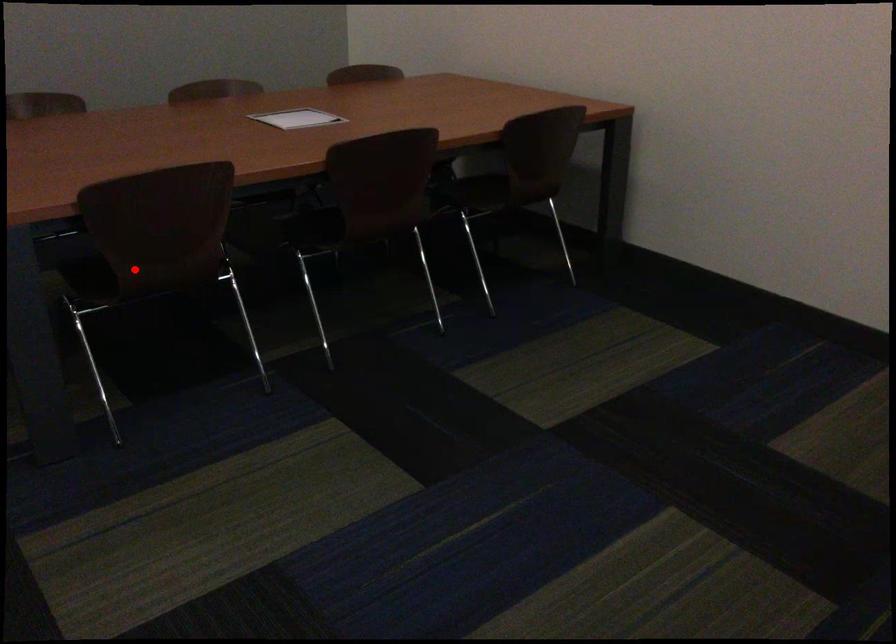
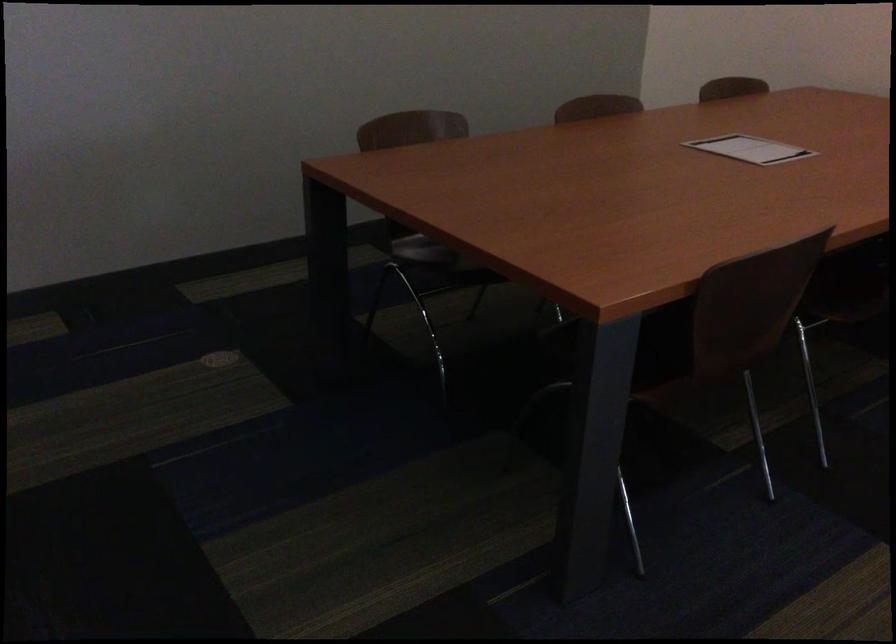
Where in the second image is the point corresponding to the highlighted location from the first image?

(710, 357)